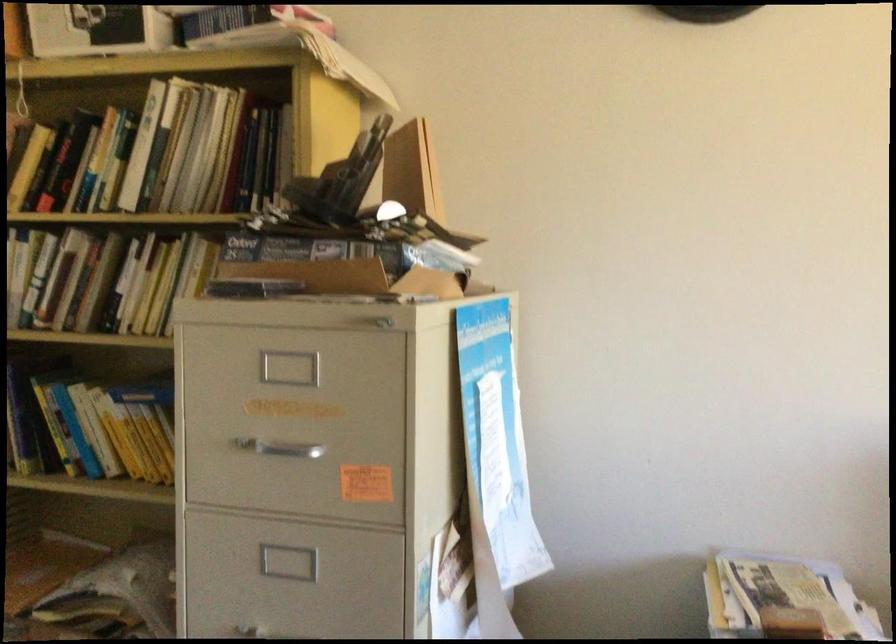
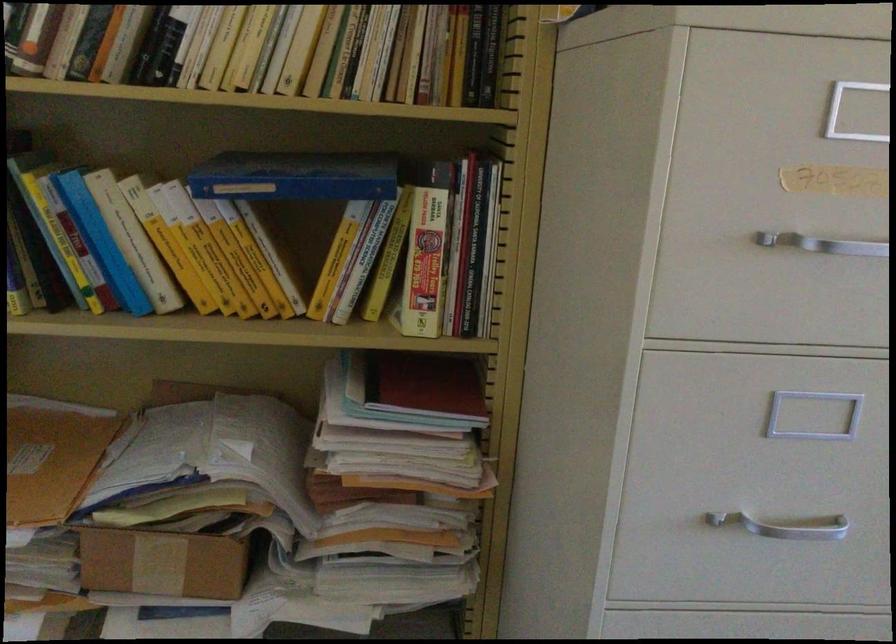
Locate, in the second image, the point that corresponds to (273,448) in the first image.

(823, 243)